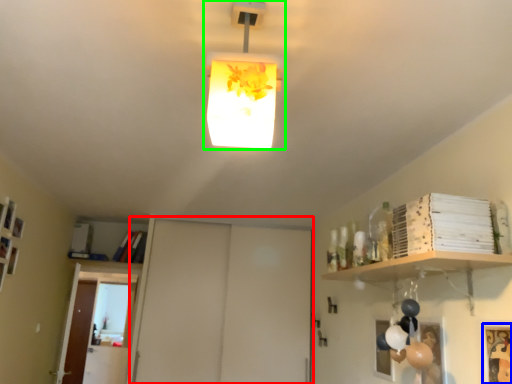
Question: Which object is positioned closest to door (highlighted by a red box)? Select from picture frame (highlighted by a blue box) and lamp (highlighted by a green box).

Choices:
 (A) picture frame
 (B) lamp

Answer: (A)